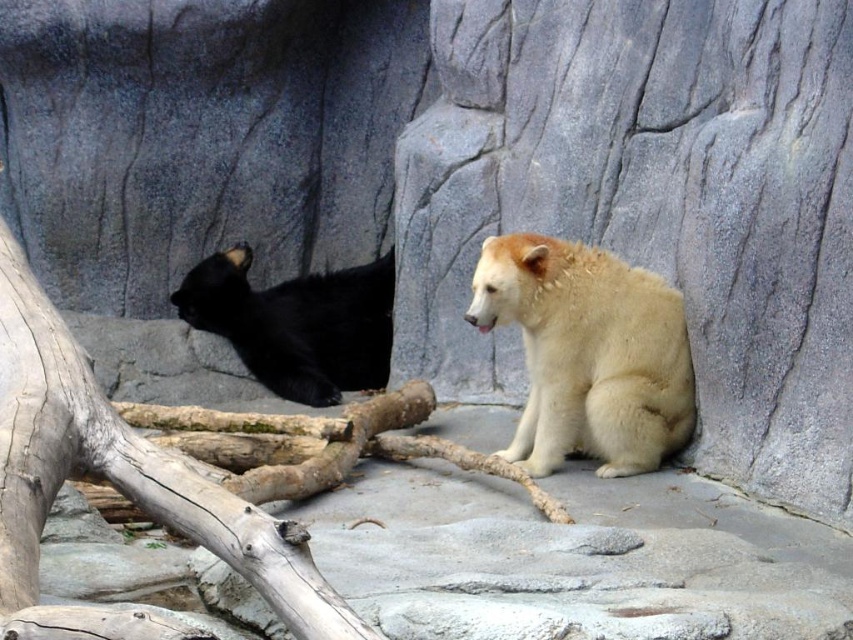
You are standing in front of the zoo enclosure with two bears. You notice two specific points marked in the image. One is at coordinate point (683, 326) and the other is at point (370, 289). Which of these two points is nearer to your viewpoint?

Point (683, 326) is closer to the camera than point (370, 289), so the point at coordinate point (683, 326) is nearer to your viewpoint.

You are a zookeeper trying to place a new feeding bowl for the fuzzy white bear at center. The bowl requires a stable surface that is larger than the bear itself. Based on the scene, is the smooth gray tree trunk at left a suitable surface for placing the bowl?

The smooth gray tree trunk at left is bigger than the fuzzy white bear at center, so it can provide a stable and larger surface for placing the feeding bowl.

You are standing at the point marked as point [589,353] in the zoo enclosure. Which direction should you look to see the fuzzy white bear at center?

The fuzzy white bear at center is located exactly at the point you are standing, so you are already facing it.